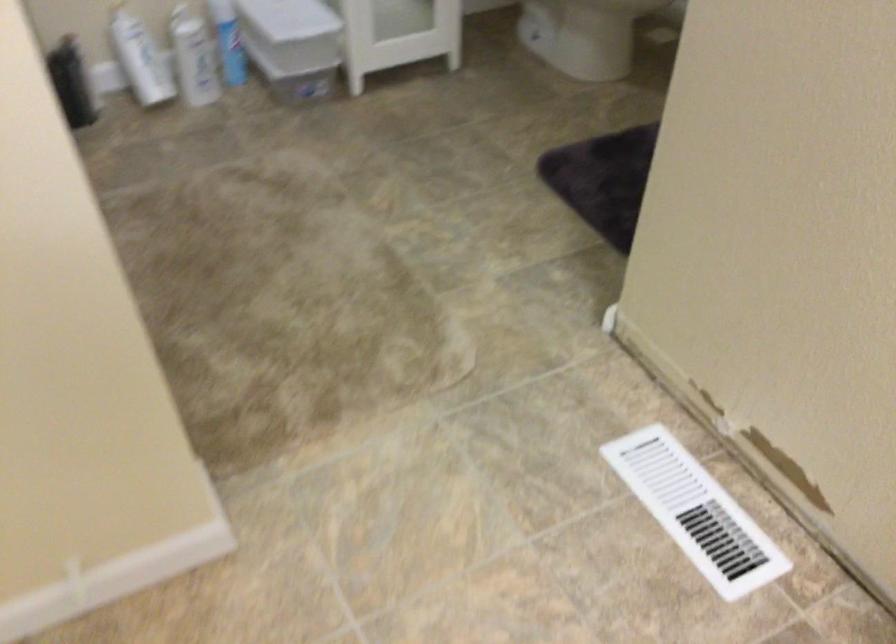
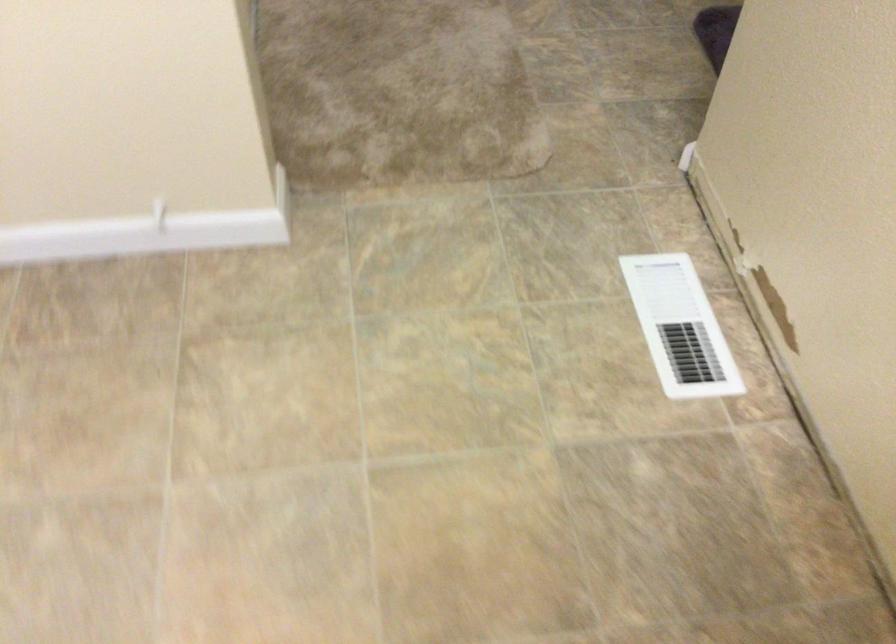
Consider the image. In a continuous first-person perspective shot, in which direction is the camera moving?

The cameraman walked toward right, backward.